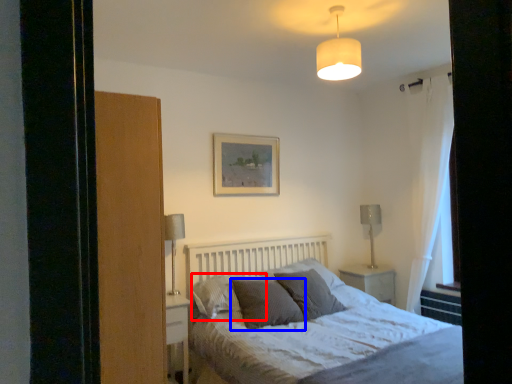
Question: Which point is closer to the camera, pillow (highlighted by a red box) or pillow (highlighted by a blue box)?

Choices:
 (A) pillow
 (B) pillow

Answer: (B)